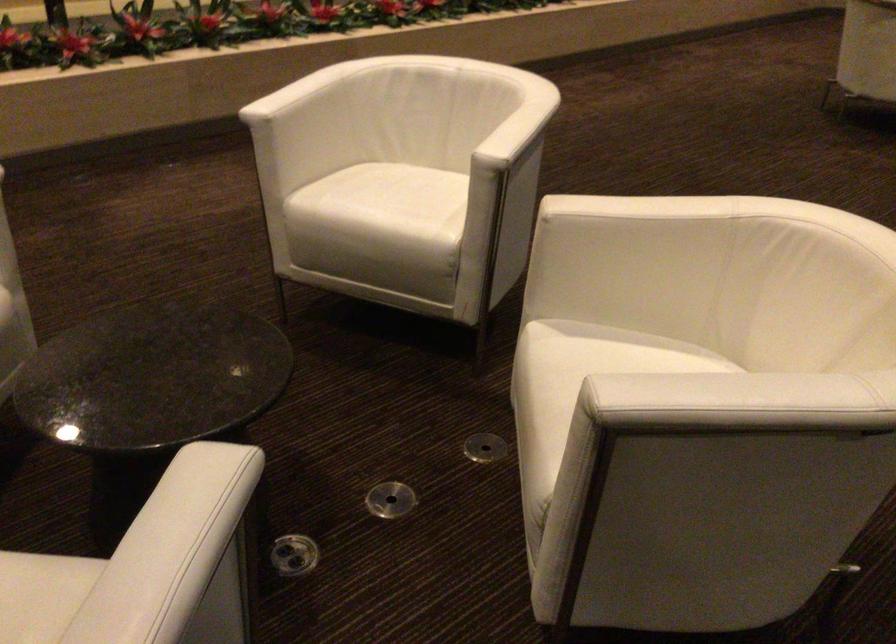
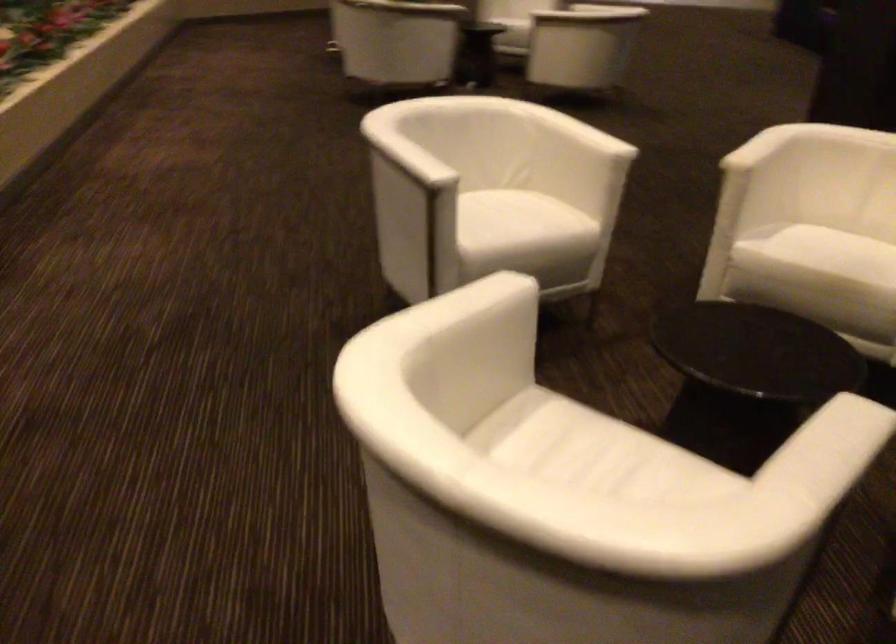
In the second image, find the point that corresponds to (401,190) in the first image.

(502, 214)